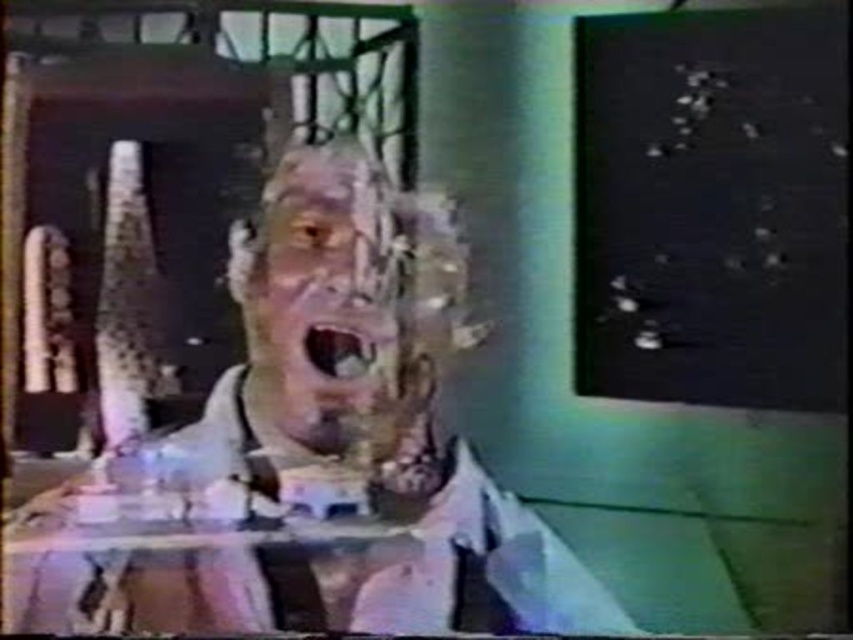
You are a film director analyzing the scene. You need to place a microphone 40 inches away from the matte plastic mannequin head at center to capture the actor. Is the current distance sufficient?

The distance between the matte plastic mannequin head at center and the viewer is 39.10 inches. Since the required distance is 40 inches, the current distance is slightly insufficient by 0.90 inches.

You are a film editor reviewing this scene. The mannequin head is at point (308, 451). If you want to zoom in on the mannequin head, which coordinates should you focus on?

The matte plastic mannequin head at center is represented by point (308, 451), so you should focus on those coordinates to zoom in on it.